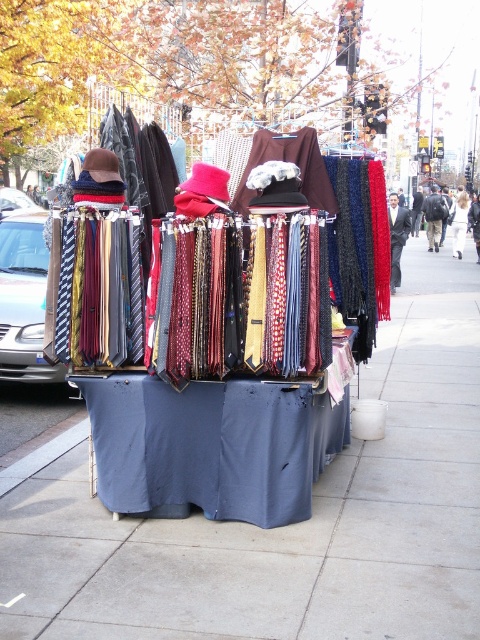
Question: Which point appears closest to the camera in this image?

Choices:
 (A) (436, 221)
 (B) (6, 468)

Answer: (B)

Question: Is smooth concrete pavement at center behind black leather backpack at center?

Choices:
 (A) no
 (B) yes

Answer: (A)

Question: Is gray concrete curb at lower left bigger than black leather backpack at center?

Choices:
 (A) yes
 (B) no

Answer: (B)

Question: Which point is closer to the camera taking this photo?

Choices:
 (A) (47, 452)
 (B) (468, 557)

Answer: (B)

Question: Among these objects, which one is farthest from the camera?

Choices:
 (A) black leather backpack at center
 (B) white fabric at center
 (C) smooth concrete pavement at center
 (D) gray concrete curb at lower left

Answer: (A)

Question: Does gray concrete curb at lower left lie behind velvet burgundy tie at center?

Choices:
 (A) no
 (B) yes

Answer: (A)